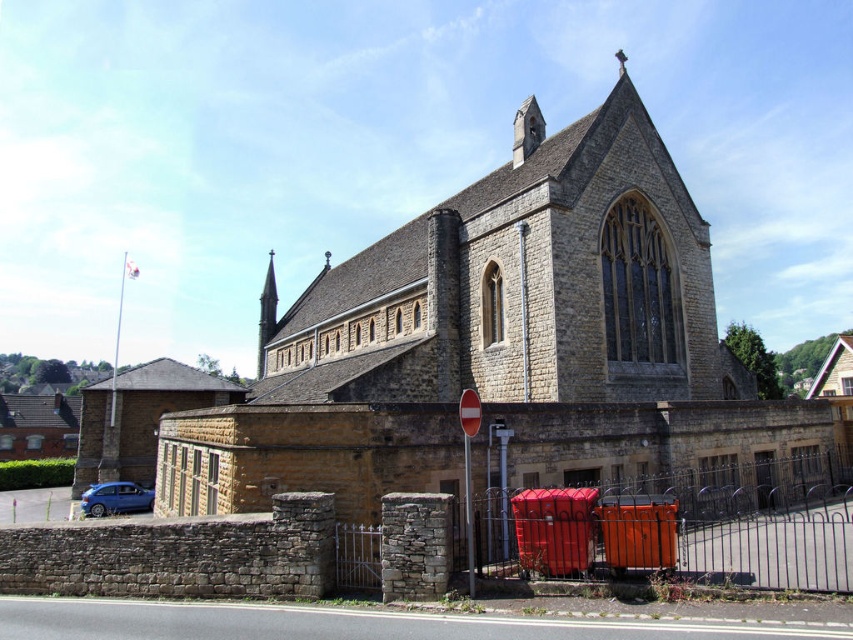
Question: Does stone church at center appear on the left side of metallic blue hatchback at lower left?

Choices:
 (A) no
 (B) yes

Answer: (A)

Question: Among these points, which one is nearest to the camera?

Choices:
 (A) (740, 422)
 (B) (99, 490)

Answer: (A)

Question: Which of the following is the closest to the observer?

Choices:
 (A) (659, 307)
 (B) (131, 506)

Answer: (A)

Question: Can you confirm if stone church at center is positioned to the right of metallic blue hatchback at lower left?

Choices:
 (A) yes
 (B) no

Answer: (A)

Question: Can you confirm if stone church at center is positioned to the left of metallic blue hatchback at lower left?

Choices:
 (A) no
 (B) yes

Answer: (A)